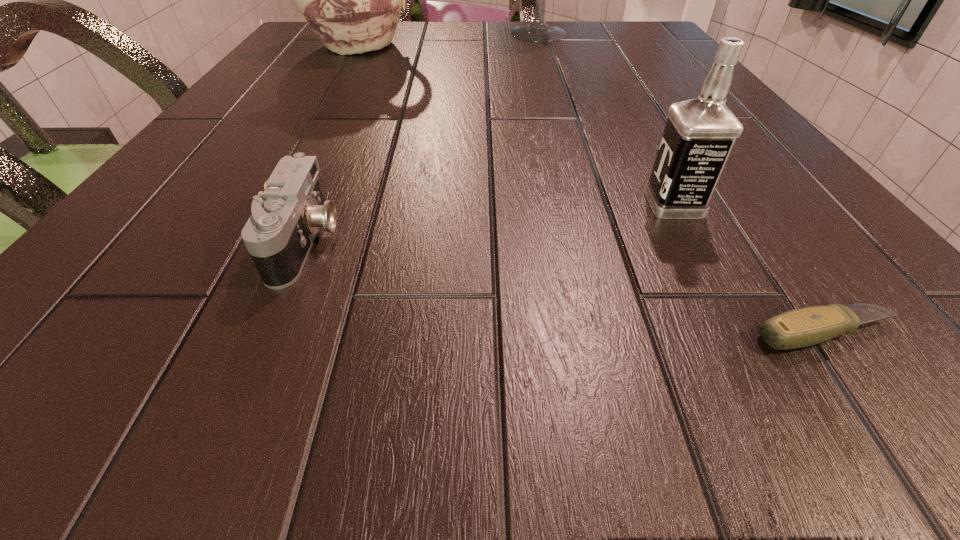
At what (x,y) coordinates should I click in order to perform the action: click on the tallest object. Please return your answer as a coordinate pair (x, y). The image size is (960, 540). Looking at the image, I should click on (538, 31).

Image resolution: width=960 pixels, height=540 pixels. Identify the location of the third object from left to right. (538, 31).

Where is `pitcher`? The height and width of the screenshot is (540, 960). pitcher is located at coordinates (352, 0).

The height and width of the screenshot is (540, 960). What are the coordinates of `vodka` in the screenshot? It's located at point(699,135).

Identify the location of camera. (286, 217).

Locate an element on the screen. the shortest object is located at coordinates (802, 327).

I want to click on the nearest object, so click(802, 327).

Identify the location of vacant space located 0.110m on the left of the alcohol. (464, 33).

Find the location of `blank area located 0.210m on the front label of the vodka`. blank area located 0.210m on the front label of the vodka is located at coordinates (490, 204).

I want to click on free point located on the front label of the vodka, so click(558, 204).